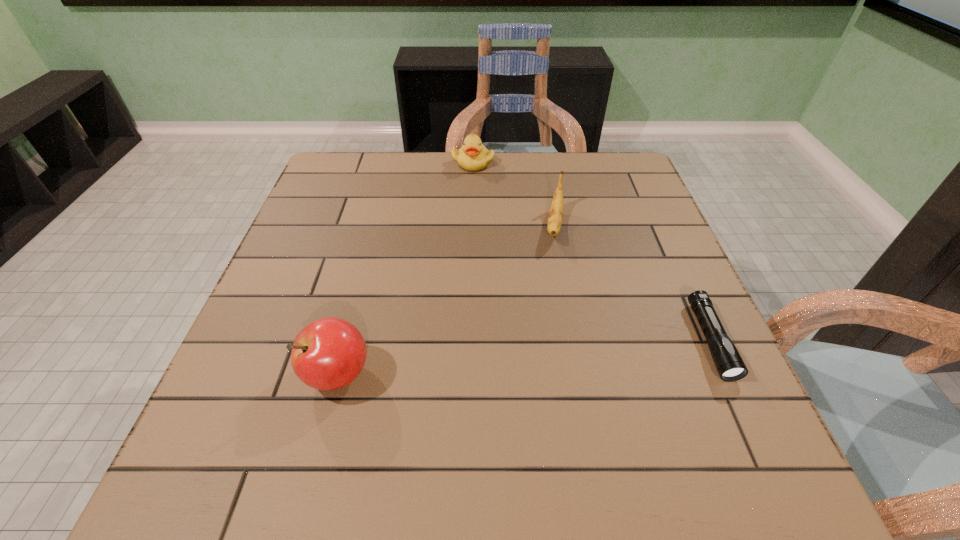
This screenshot has height=540, width=960. Find the location of `free spot on the desktop that is between the apple and the flashlight and is positioned on the peel of the second farthest object from the top`. free spot on the desktop that is between the apple and the flashlight and is positioned on the peel of the second farthest object from the top is located at coordinates (536, 356).

Where is `free spot on the desktop that is between the tallest object and the flashlight and is positioned at the face of the duckling`? free spot on the desktop that is between the tallest object and the flashlight and is positioned at the face of the duckling is located at coordinates (554, 354).